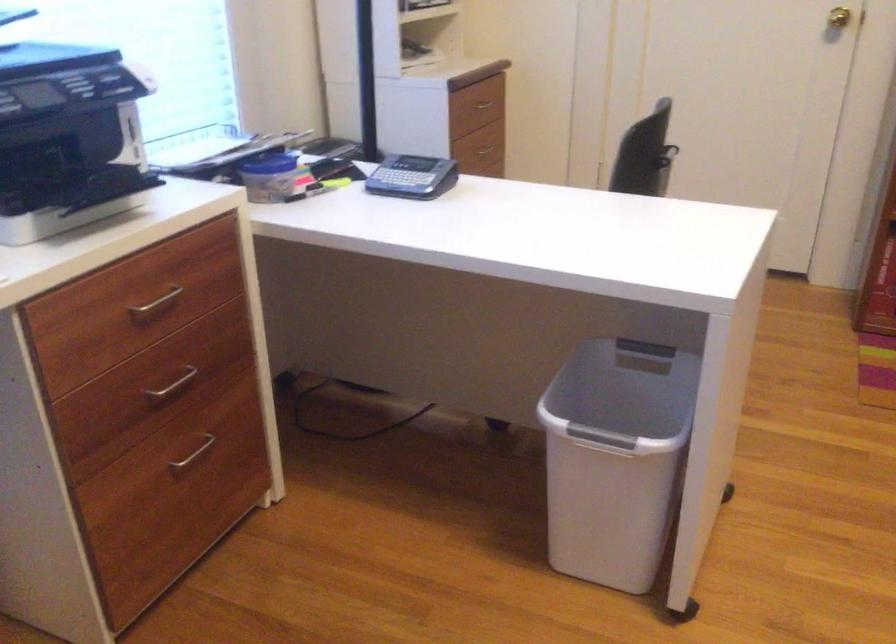
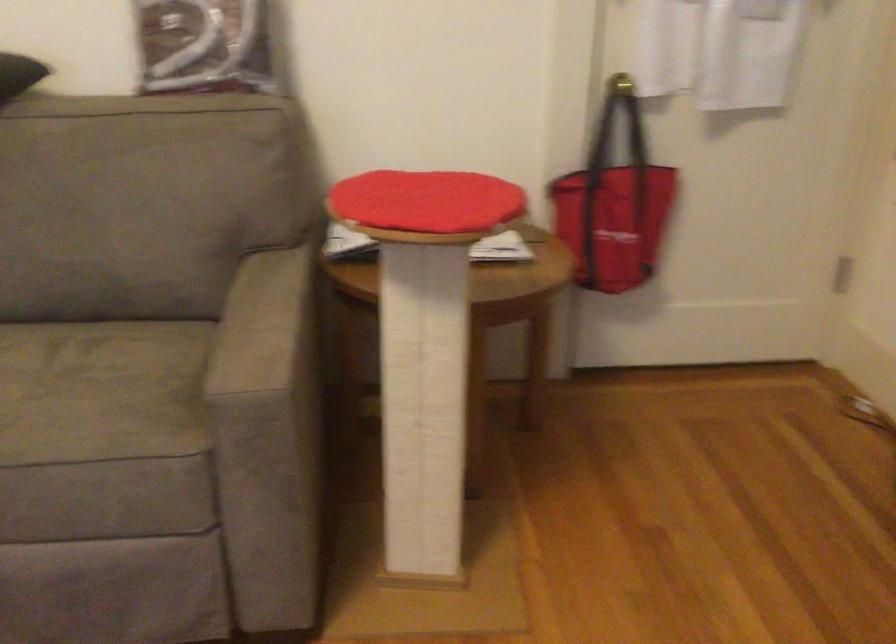
How did the camera likely rotate?

The rotation direction of the camera is right-down.